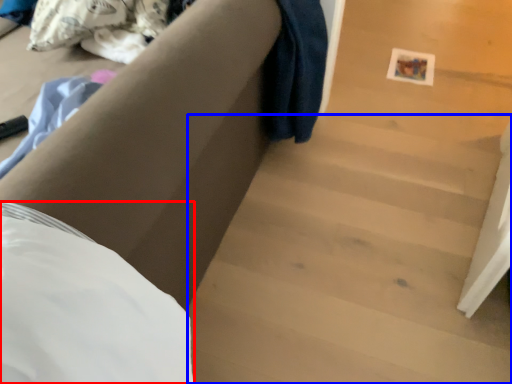
Question: Which of the following is the closest to the observer, sheet (highlighted by a red box) or stairwell (highlighted by a blue box)?

Choices:
 (A) sheet
 (B) stairwell

Answer: (A)